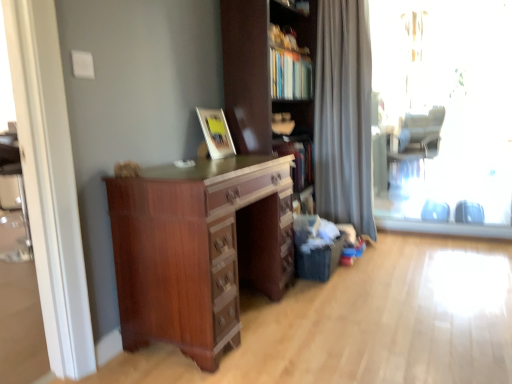
Identify the location of vacant region to the right of matte wooden picture frame at upper center. The width and height of the screenshot is (512, 384). (248, 150).